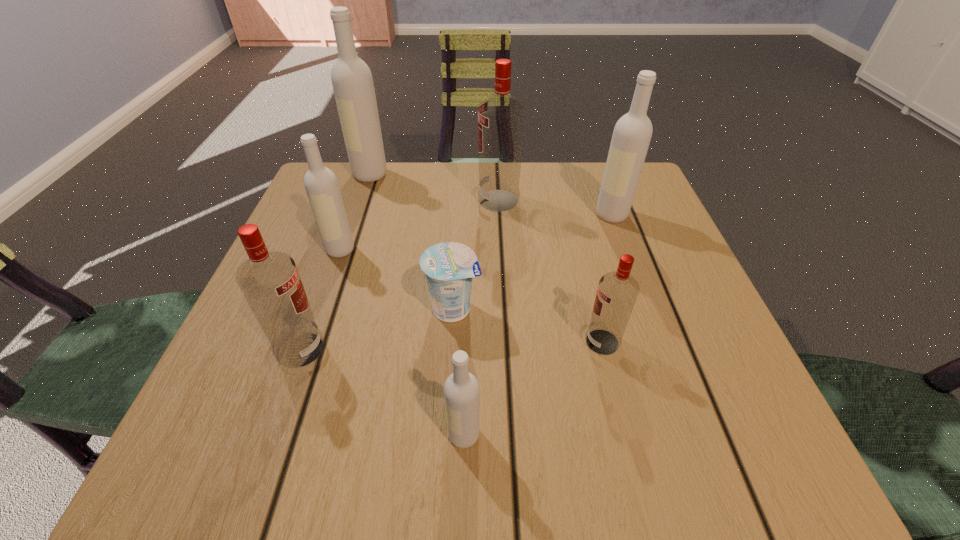
The height and width of the screenshot is (540, 960). I want to click on object at the far right corner, so click(x=632, y=133).

At what (x,y) coordinates should I click in order to perform the action: click on vacant region at the far edge. Please return your answer as a coordinate pair (x, y). The width and height of the screenshot is (960, 540). Looking at the image, I should click on (425, 193).

This screenshot has height=540, width=960. Find the location of `vacant area at the near edge of the desktop`. vacant area at the near edge of the desktop is located at coordinates (473, 461).

Where is `free location at the left edge of the desktop`? The width and height of the screenshot is (960, 540). free location at the left edge of the desktop is located at coordinates (310, 378).

Where is `vacant space at the right edge`? This screenshot has height=540, width=960. vacant space at the right edge is located at coordinates (611, 261).

The height and width of the screenshot is (540, 960). I want to click on free region at the far left corner of the desktop, so click(381, 180).

At what (x,y) coordinates should I click in order to perform the action: click on vacant space at the near left corner of the desktop. Please return your answer as a coordinate pair (x, y). Looking at the image, I should click on (273, 433).

The image size is (960, 540). In the image, there is a desktop. What are the coordinates of `vacant space at the far right corner` in the screenshot? It's located at (636, 217).

The height and width of the screenshot is (540, 960). In order to click on vacant region between the second red vodka from right to left and the shortest object in this screenshot , I will do `click(476, 255)`.

I want to click on free point between the shortest object and the rightmost white vodka, so click(533, 262).